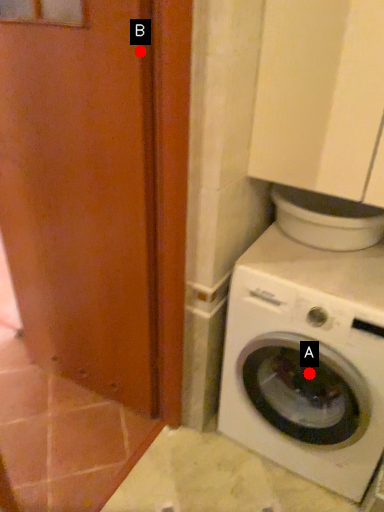
Question: Two points are circled on the image, labeled by A and B beside each circle. Which of the following is the closest to the observer?

Choices:
 (A) A is closer
 (B) B is closer

Answer: (B)